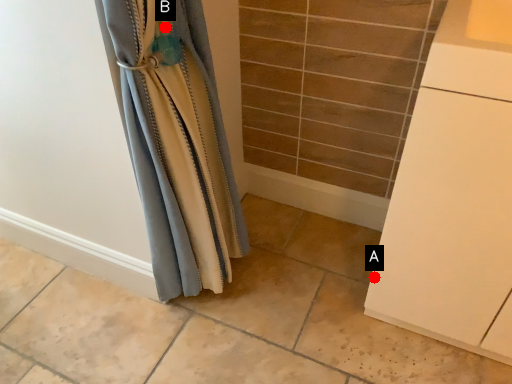
Question: Two points are circled on the image, labeled by A and B beside each circle. Which point appears farthest from the camera in this image?

Choices:
 (A) A is further
 (B) B is further

Answer: (A)